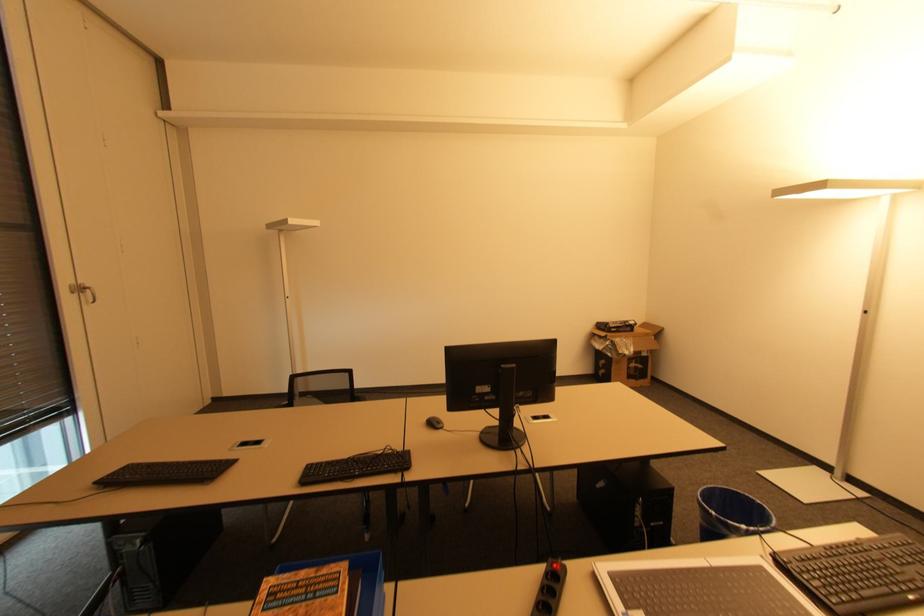
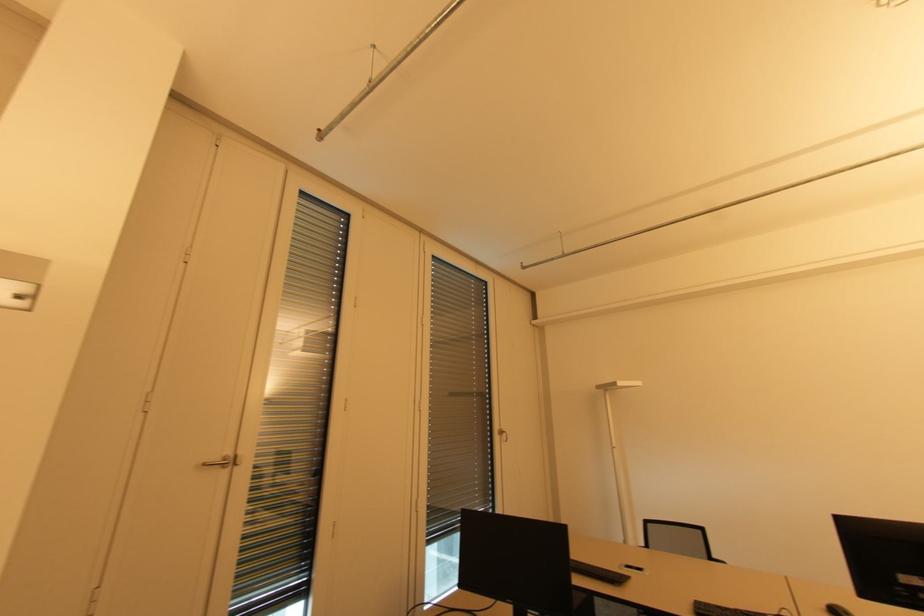
Locate, in the second image, the point that corresponds to point (74, 294) in the first image.

(501, 435)